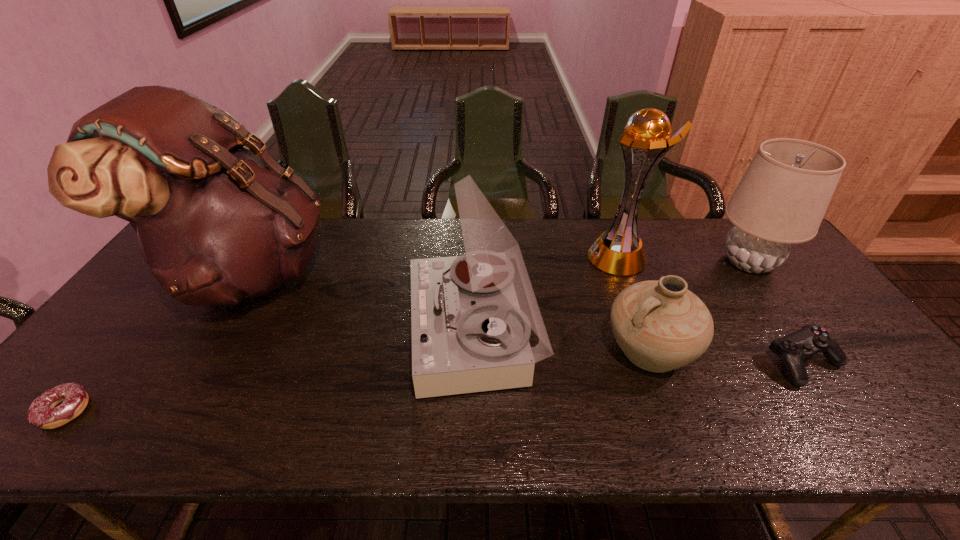
Image resolution: width=960 pixels, height=540 pixels. What are the coordinates of `free spot at the near left corner of the desktop` in the screenshot? It's located at (35, 428).

Find the location of a particular element. free space between the pottery and the second shortest object is located at coordinates (727, 356).

Where is `free area in between the trophy and the lampshade`? free area in between the trophy and the lampshade is located at coordinates (684, 260).

Identify the location of vacant area that lies between the trophy and the control. (711, 310).

Identify the location of empty space between the fifth tallest object and the shortest object. The image size is (960, 540). (358, 380).

I want to click on free area in between the shortest object and the satchel, so click(x=157, y=341).

Identify the location of free space that is in between the control and the lampshade. Image resolution: width=960 pixels, height=540 pixels. (777, 312).

Identify the location of object that stands as the fourth closest to the satchel. (619, 251).

The image size is (960, 540). Find the location of `object identified as the second closest to the lampshade`. object identified as the second closest to the lampshade is located at coordinates (800, 345).

Where is `free region that satisfies the following two spatial constraints: 1. at the front of the satchel with buckles; 2. on the right side of the pottery`? This screenshot has width=960, height=540. free region that satisfies the following two spatial constraints: 1. at the front of the satchel with buckles; 2. on the right side of the pottery is located at coordinates (x=203, y=350).